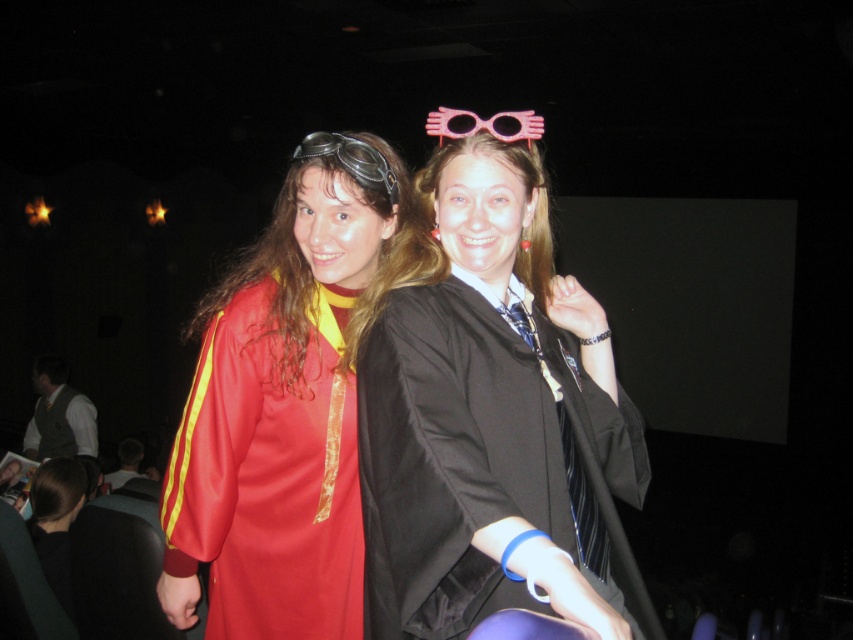
You are a photographer at a costume party. You need to adjust the lighting so that the matte red gown at center is well lit while keeping the dark brown leather jacket at lower left in shadow. Is the current arrangement possible without moving any objects?

The matte red gown at center is in front of the dark brown leather jacket at lower left, so yes, the photographer can adjust the lighting to highlight the gown while leaving the jacket in shadow without moving any objects.

You are a photographer trying to capture a group photo of the matte black graduation gown at center and the matte red gown at center. The camera you are using has a minimum focus distance of 10 inches. Can you focus on both subjects simultaneously?

The matte black graduation gown at center and the matte red gown at center are 10.39 inches apart, so yes, the camera can focus on both subjects since the distance between them is greater than the minimum focus distance of 10 inches.

You are a photographer at a costume party. You want to take a photo that clearly shows both the matte red gown at center and the matte gray vest at lower left. However, you notice that one is blocking the view of the other. Which object is blocking the other?

The matte red gown at center is blocking the view of the matte gray vest at lower left because it is positioned in front of it.